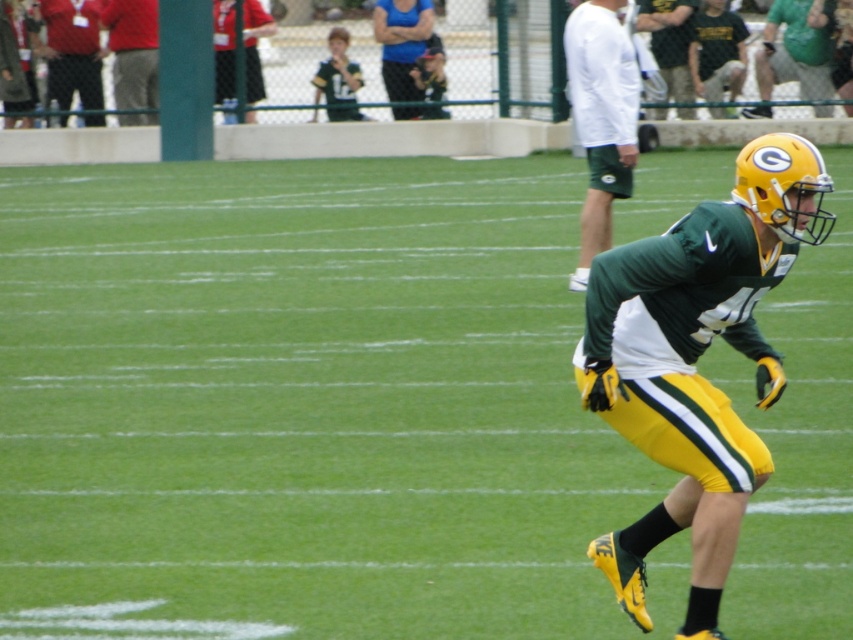
You are a photographer positioned at the point with coordinates (x=601, y=116). You want to capture a photo of the football player running towards the right side of the frame. Is the white long sleeve shirt at upper center in your field of view?

The point (x=601, y=116) indicates the white long sleeve shirt at upper center, so yes, the photographer is positioned directly at the location of the white long sleeve shirt at upper center and would have it in their field of view.